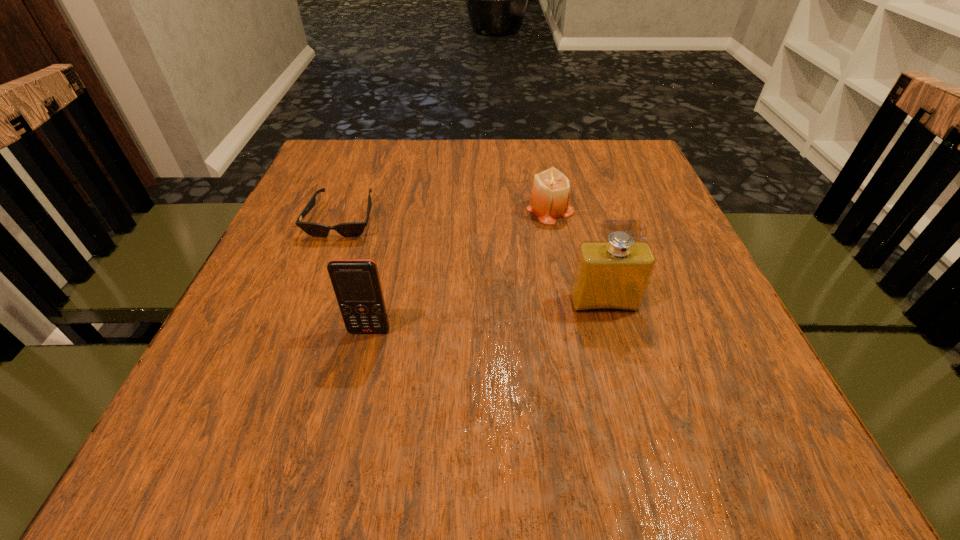
Where is `object that is at the left edge`? object that is at the left edge is located at coordinates (352, 229).

The height and width of the screenshot is (540, 960). I want to click on object positioned at the right edge, so click(609, 276).

The height and width of the screenshot is (540, 960). Identify the location of blank space at the far edge of the desktop. (433, 181).

Locate an element on the screen. free space at the left edge of the desktop is located at coordinates (321, 289).

The width and height of the screenshot is (960, 540). What are the coordinates of `blank space at the right edge` in the screenshot? It's located at (657, 216).

This screenshot has height=540, width=960. In order to click on free space at the far left corner of the desktop in this screenshot , I will do `click(334, 160)`.

The height and width of the screenshot is (540, 960). What are the coordinates of `vacant space at the far right corner of the desktop` in the screenshot? It's located at (618, 157).

Find the location of a particular element. The image size is (960, 540). vacant area that lies between the second object from left to right and the perfume is located at coordinates (487, 317).

In order to click on free spot between the perfume and the cellular telephone in this screenshot , I will do `click(487, 317)`.

Identify the location of free point between the second shortest object and the perfume. Image resolution: width=960 pixels, height=540 pixels. (577, 256).